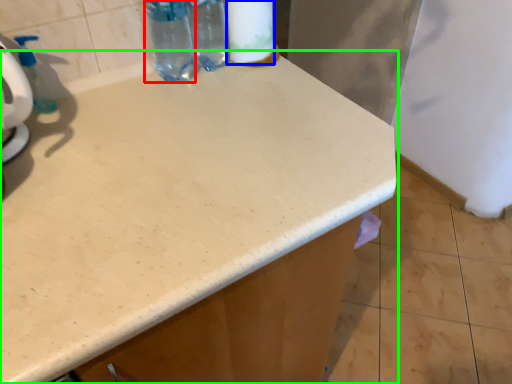
Question: Which object is the farthest from bottle (highlighted by a red box)? Choose among these: toilet paper (highlighted by a blue box) or countertop (highlighted by a green box).

Choices:
 (A) toilet paper
 (B) countertop

Answer: (B)